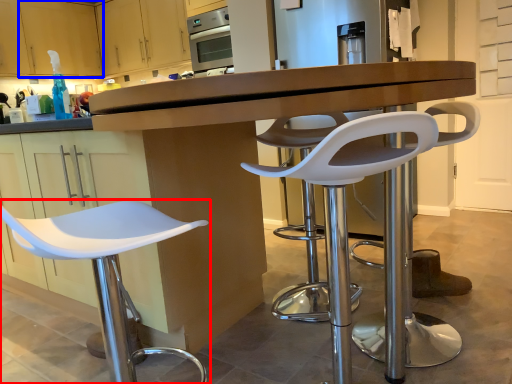
Question: Which object appears farthest to the camera in this image, chair (highlighted by a red box) or cabinetry (highlighted by a blue box)?

Choices:
 (A) chair
 (B) cabinetry

Answer: (B)